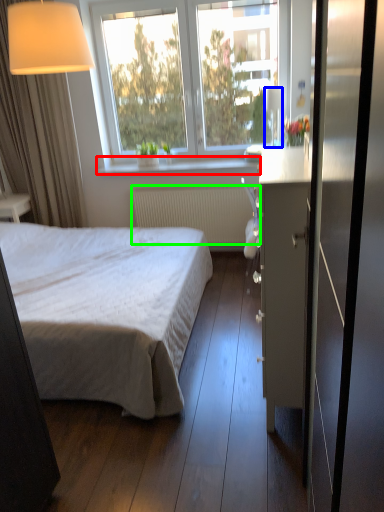
Question: Based on their relative distances, which object is farther from window sill (highlighted by a red box)? Choose from lamp (highlighted by a blue box) and radiator (highlighted by a green box).

Choices:
 (A) lamp
 (B) radiator

Answer: (A)